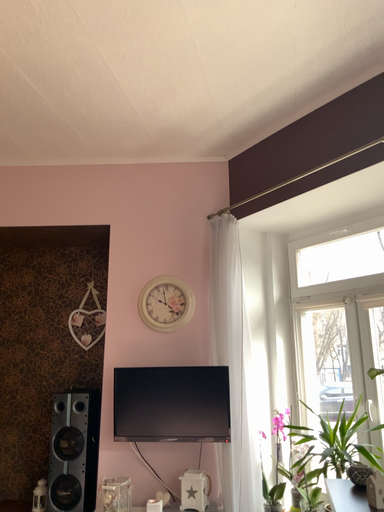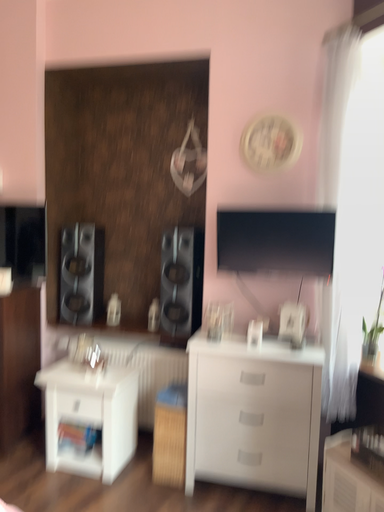
Question: How did the camera likely rotate when shooting the video?

Choices:
 (A) rotated upward
 (B) rotated downward

Answer: (B)